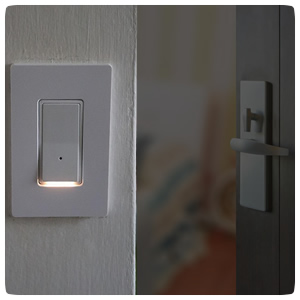
This screenshot has height=300, width=300. Find the location of `backlighting`. backlighting is located at coordinates (58, 187).